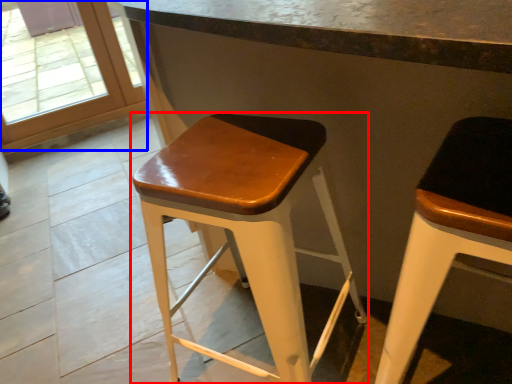
Question: Which of the following is the closest to the observer, stool (highlighted by a red box) or glass door (highlighted by a blue box)?

Choices:
 (A) stool
 (B) glass door

Answer: (A)